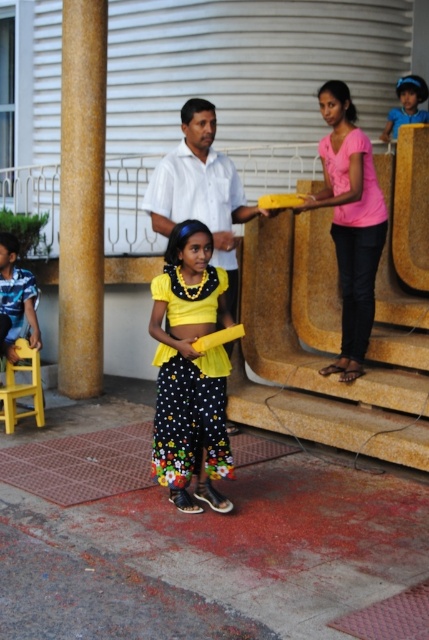
You are a photographer setting up for an event. You have a yellow plastic chair at lower left and a black leather sandal at lower center in your frame. To ensure the sandal is centered in the photo, should you move the chair to the right or left?

The yellow plastic chair at lower left is to the left of the black leather sandal at lower center. To center the sandal, move the chair to the right so the sandal is in the middle of the frame.

You are setting up decorations for an event and need to place a large banner. You have a golden textured pillar at left and a yellow plastic chair at lower left. Which object should you choose to hang the banner on if you want it to be more stable?

The golden textured pillar at left is larger in size than the yellow plastic chair at lower left, so it would provide a more stable surface for hanging the banner.